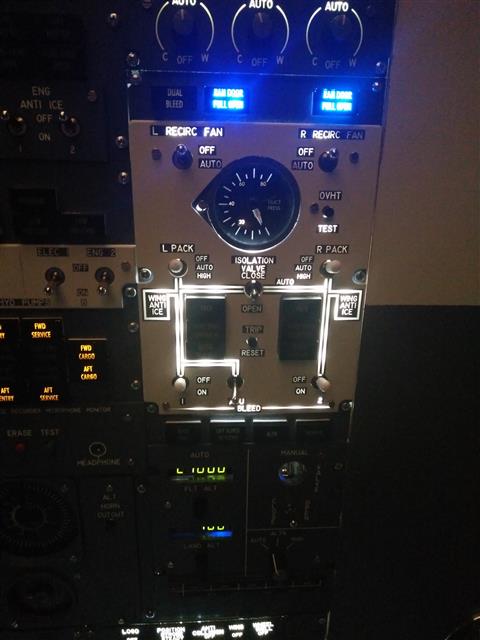
Where is `knobs`? knobs is located at coordinates (184, 29), (263, 33), (337, 33).